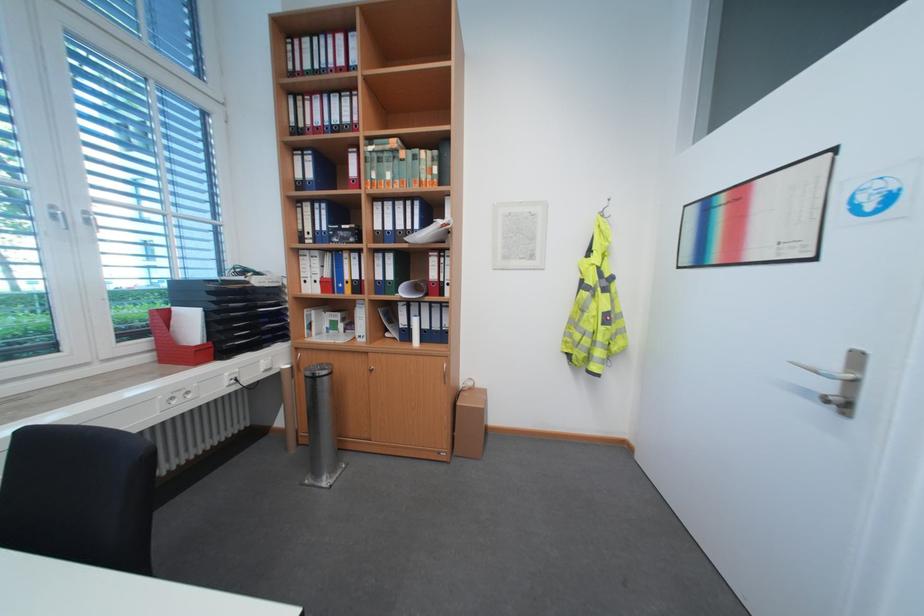
Image resolution: width=924 pixels, height=616 pixels. What are the coordinates of `silver door handle` in the screenshot? It's located at (828, 373).